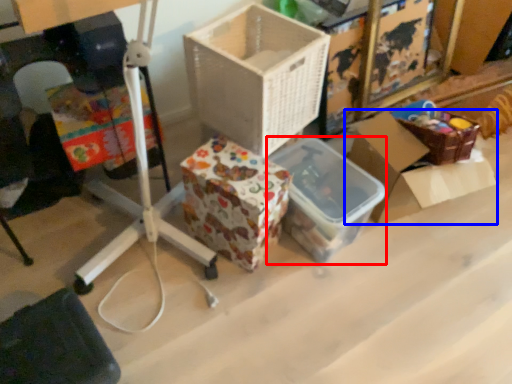
Question: Which point is closer to the camera, storage box (highlighted by a red box) or box (highlighted by a blue box)?

Choices:
 (A) storage box
 (B) box

Answer: (A)